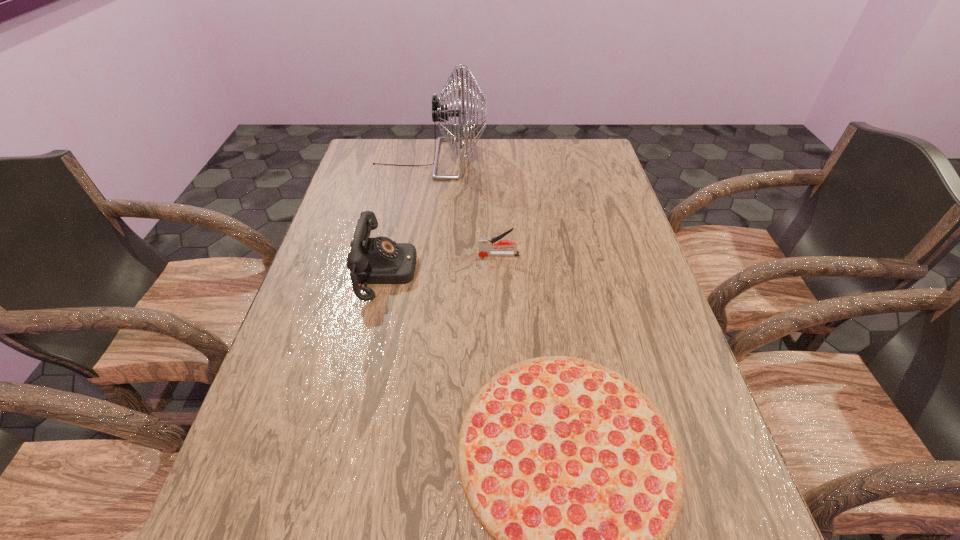
This screenshot has width=960, height=540. Find the location of `the farthest object`. the farthest object is located at coordinates (440, 113).

Where is `fan`? The width and height of the screenshot is (960, 540). fan is located at coordinates (440, 113).

At what (x,y) coordinates should I click in order to perform the action: click on the second tallest object. Please return your answer as a coordinate pair (x, y). This screenshot has height=540, width=960. Looking at the image, I should click on (380, 260).

Find the location of `stapler`. stapler is located at coordinates (485, 244).

This screenshot has width=960, height=540. In order to click on vacant space located 0.260m on the front-facing side of the farthest object in this screenshot , I will do `click(562, 159)`.

I want to click on vacant space located 0.080m on the dial of the second tallest object, so click(x=446, y=272).

The image size is (960, 540). Identify the location of free spot located on the handle side of the stapler. (350, 255).

Find the location of a particular element. vacant region located 0.400m on the handle side of the stapler is located at coordinates (328, 255).

Find the location of a particular element. Image resolution: width=960 pixels, height=540 pixels. vacant space located on the handle side of the stapler is located at coordinates (380, 255).

Find the location of `object at the far edge`. object at the far edge is located at coordinates (440, 113).